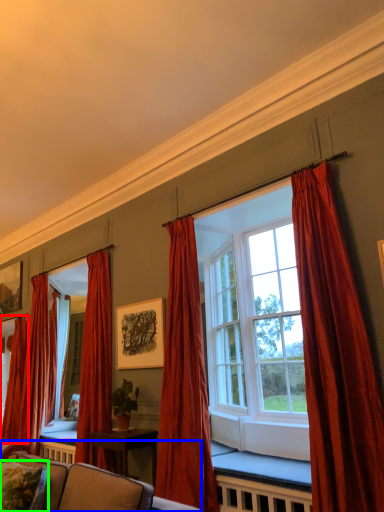
Question: Based on their relative distances, which object is farther from curtain (highlighted by a red box)? Choose from studio couch (highlighted by a blue box) and pillow (highlighted by a green box).

Choices:
 (A) studio couch
 (B) pillow

Answer: (B)